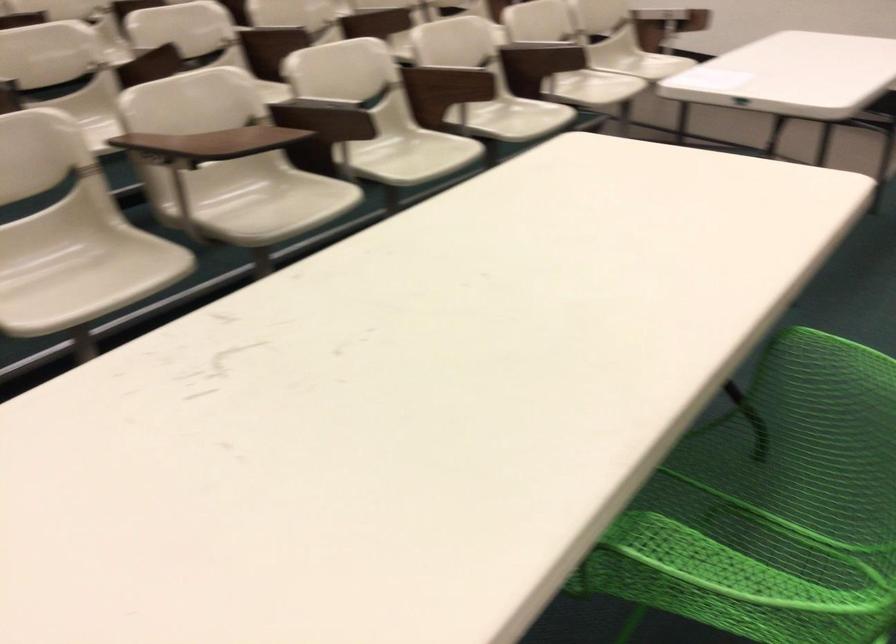
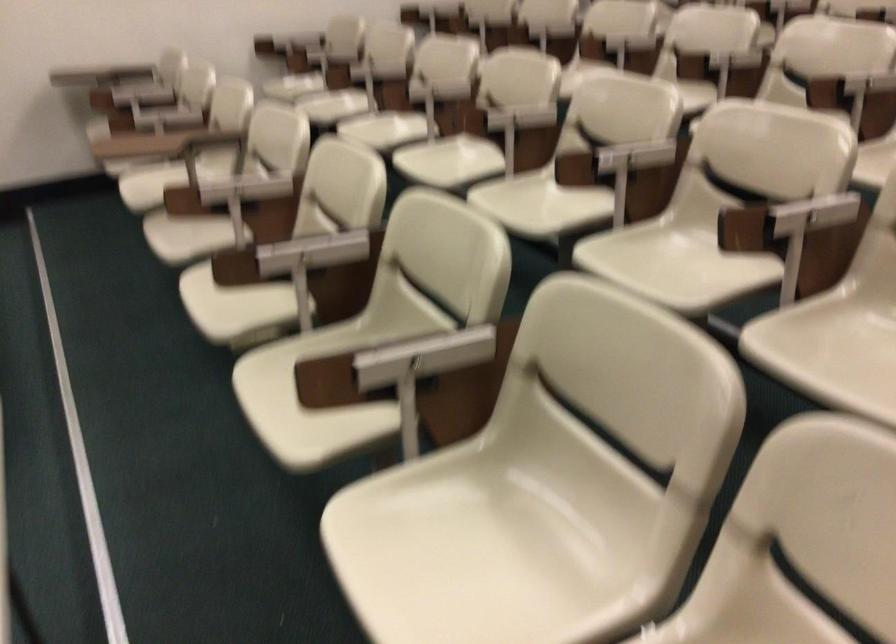
In the second image, find the point that corresponds to point (573, 107) in the first image.

(455, 540)